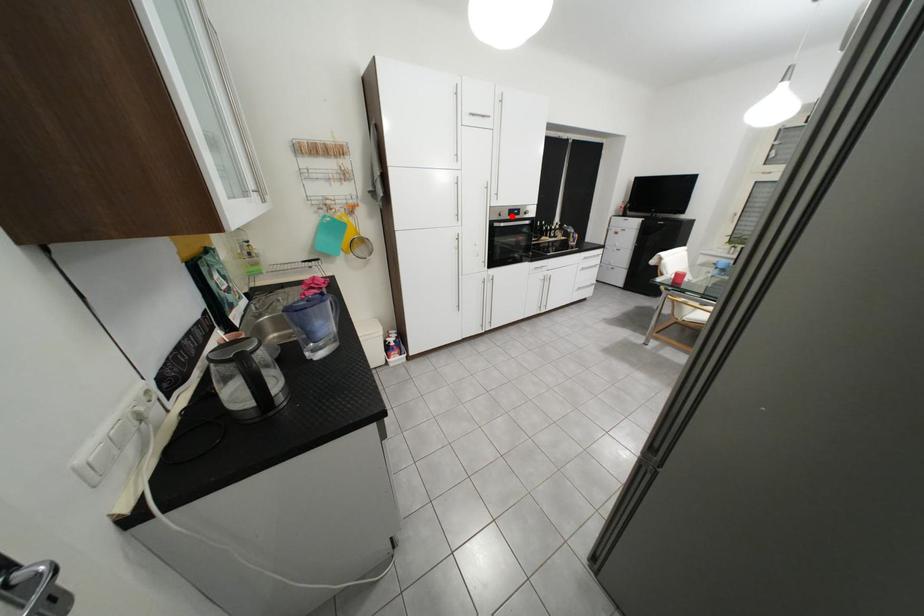
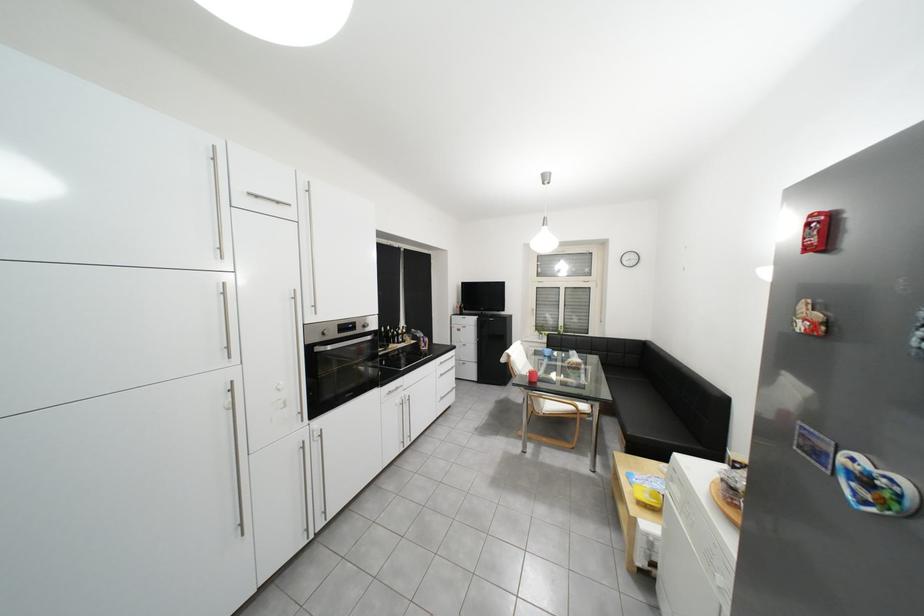
Find the pixel in the second image that matches the highlighted location in the first image.

(334, 334)